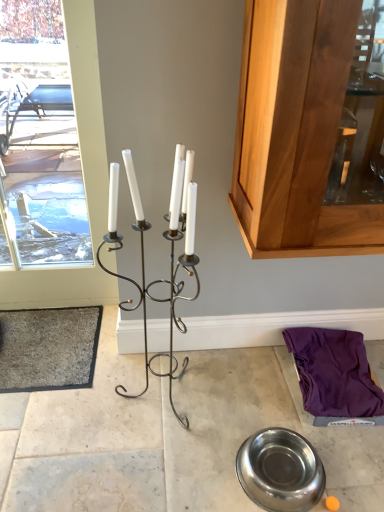
The image size is (384, 512). I want to click on vacant space that is in between black wrought iron candle holder at center and gray carpet at lower left, so click(x=86, y=391).